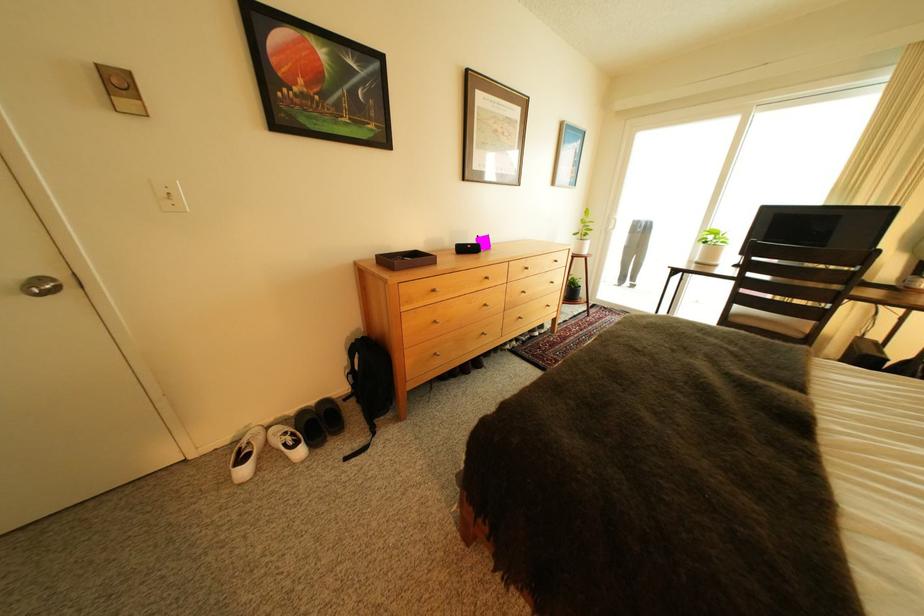
Find where to push the white light switch. Please return your answer as a coordinate pair (x, y).

(171, 196)